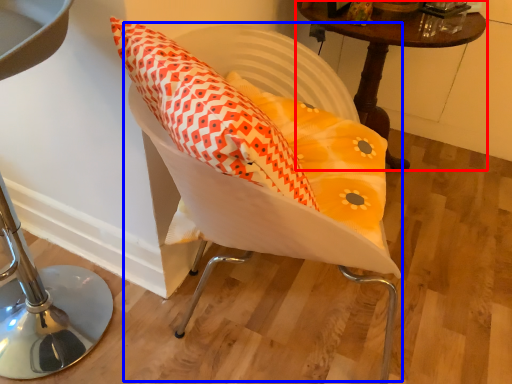
Question: Which object is closer to the camera taking this photo, table (highlighted by a red box) or swivel chair (highlighted by a blue box)?

Choices:
 (A) table
 (B) swivel chair

Answer: (B)